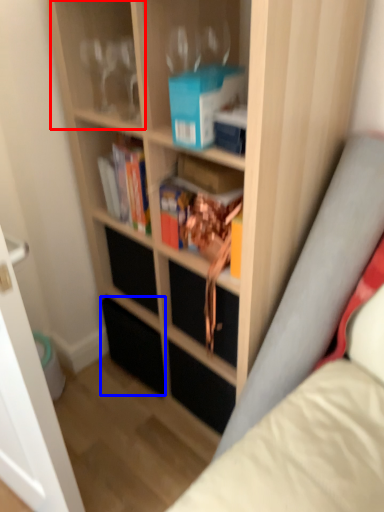
Question: Which point is closer to the camera, shelf (highlighted by a red box) or drawer (highlighted by a blue box)?

Choices:
 (A) shelf
 (B) drawer

Answer: (A)